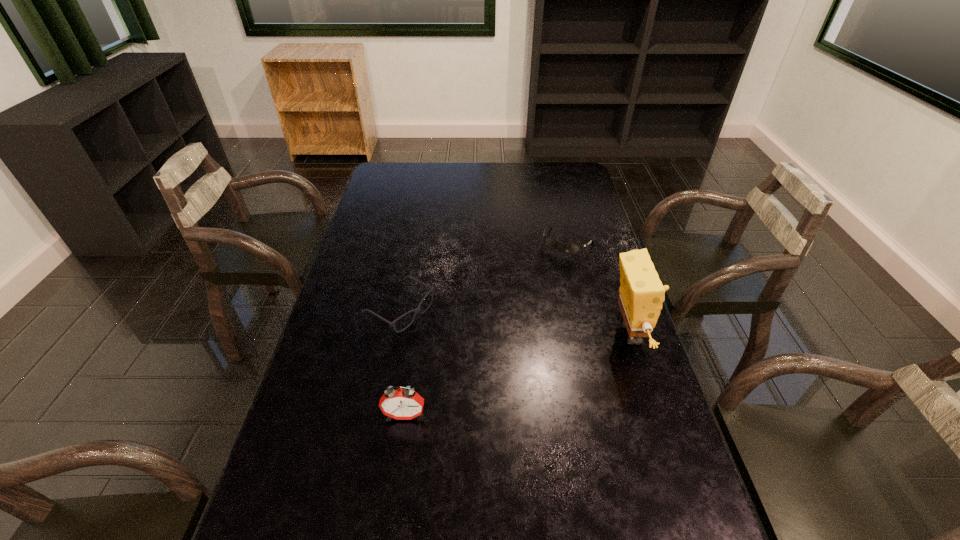
Point out which object is positioned as the second nearest to the spectacles. Please provide its 2D coordinates. Your answer should be formatted as a tuple, i.e. [(x, y)], where the tuple contains the x and y coordinates of a point satisfying the conditions above.

[(570, 248)]

Find the location of a particular element. blank space that satisfies the following two spatial constraints: 1. on the front side of the spectacles; 2. on the face of the tallest object is located at coordinates (396, 334).

Identify the location of free location that satisfies the following two spatial constraints: 1. on the front side of the tallest object; 2. on the face of the spectacles. This screenshot has height=540, width=960. (396, 334).